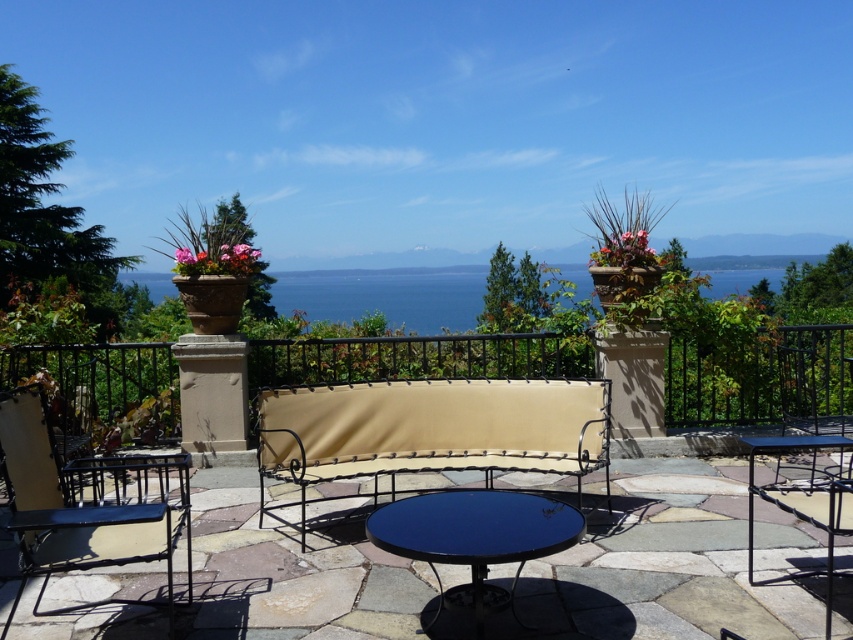
You are sitting on the metallic silver chair at center and want to move to the metallic wrought iron bench at center. Which direction should you move to reach it?

The metallic wrought iron bench at center is further to the viewer than the metallic silver chair at center, so you should move forward to reach it.

Based on the photo, you are standing at the center of the patio and want to sit down. There is a metallic wrought iron bench at center located at point (659,563). Is the bench positioned exactly at the center of the patio?

Yes, the metallic wrought iron bench at center is positioned exactly at the center of the patio as it is located at point (659,563).